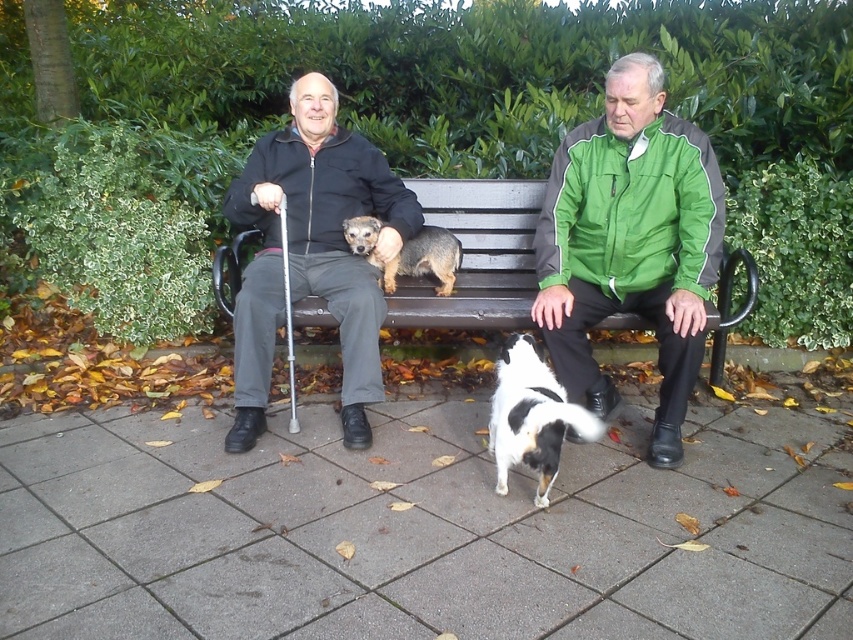
At what (x,y) coordinates should I click in order to perform the action: click on green fabric jacket at right. Please return your answer as a coordinate pair (x, y). The height and width of the screenshot is (640, 853). Looking at the image, I should click on coord(630,243).

Consider the image. Between green fabric jacket at right and wooden bench at center, which one appears on the right side from the viewer's perspective?

From the viewer's perspective, green fabric jacket at right appears more on the right side.

Which is in front, point (711, 234) or point (426, 195)?

Point (711, 234) is in front.

The image size is (853, 640). In order to click on green fabric jacket at right in this screenshot , I will do `click(630, 243)`.

Can you confirm if black matte jacket at center is thinner than wooden bench at center?

In fact, black matte jacket at center might be wider than wooden bench at center.

Is black matte jacket at center closer to camera compared to wooden bench at center?

Yes.

Between point (245, 451) and point (490, 230), which one is positioned behind?

The point (490, 230) is behind.

Where is `black matte jacket at center`? Image resolution: width=853 pixels, height=640 pixels. black matte jacket at center is located at coordinates (312, 253).

Between black matte jacket at center and brown textured dog at center, which one appears on the right side from the viewer's perspective?

From the viewer's perspective, brown textured dog at center appears more on the right side.

Can you confirm if black matte jacket at center is thinner than brown textured dog at center?

No.

Identify the location of black matte jacket at center. This screenshot has width=853, height=640. (312, 253).